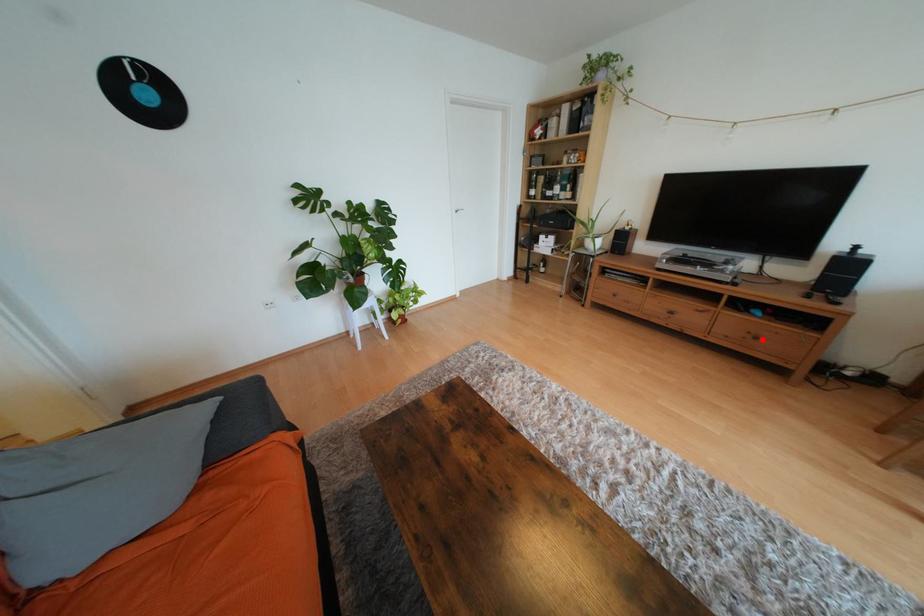
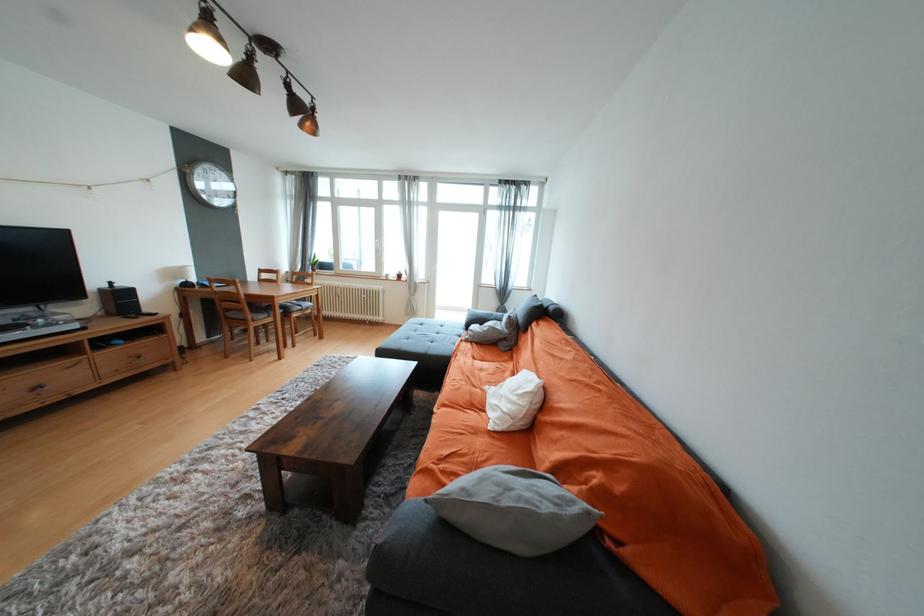
Where in the second image is the point corresponding to the highlighted location from the first image?

(146, 358)